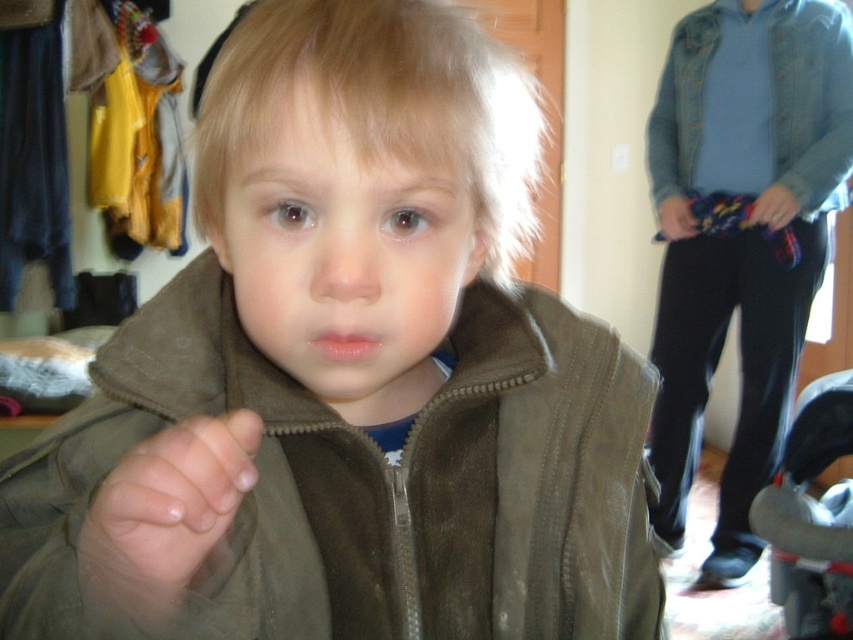
You are a photographer adjusting the focus in the image. You need to focus on both the point at (746, 180) and the point at (215, 529). Which point should you adjust your focus to first to ensure both are in focus?

You should focus on point (746, 180) first because it is closer to the camera than point (215, 529). This way, adjusting focus from closer to farther will help both points come into focus.

You are a photographer adjusting the lighting in the room. You notice the brown suede jacket at upper right and the smooth skin hand at center. Which object is positioned to the right side of the other?

The brown suede jacket at upper right is to the right of the smooth skin hand at center.